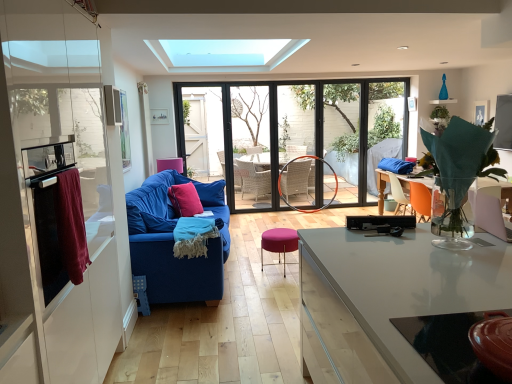
Question: In the image, is black plastic tv at center, marked as the 1th appliance in a back-to-front arrangement, on the left side or the right side of orange plastic chair at right?

Choices:
 (A) left
 (B) right

Answer: (A)

Question: Is black plastic tv at center, the 2th appliance positioned from the left, situated inside orange plastic chair at right or outside?

Choices:
 (A) inside
 (B) outside

Answer: (B)

Question: Which is nearer to the maroon fabric towel at left?

Choices:
 (A) stainless steel oven at left, placed as the 1th appliance when sorted from left to right
 (B) purple fabric stool at center
 (C) orange plastic chair at right
 (D) pink velvet pillow at center
 (E) transparent glass door at center

Answer: (A)

Question: Which is nearer to the blue textured blanket at center?

Choices:
 (A) pink fabric armchair at center
 (B) maroon fabric towel at left
 (C) velvet blue sofa at center left
 (D) purple fabric stool at center
 (E) transparent glass window at center

Answer: (C)